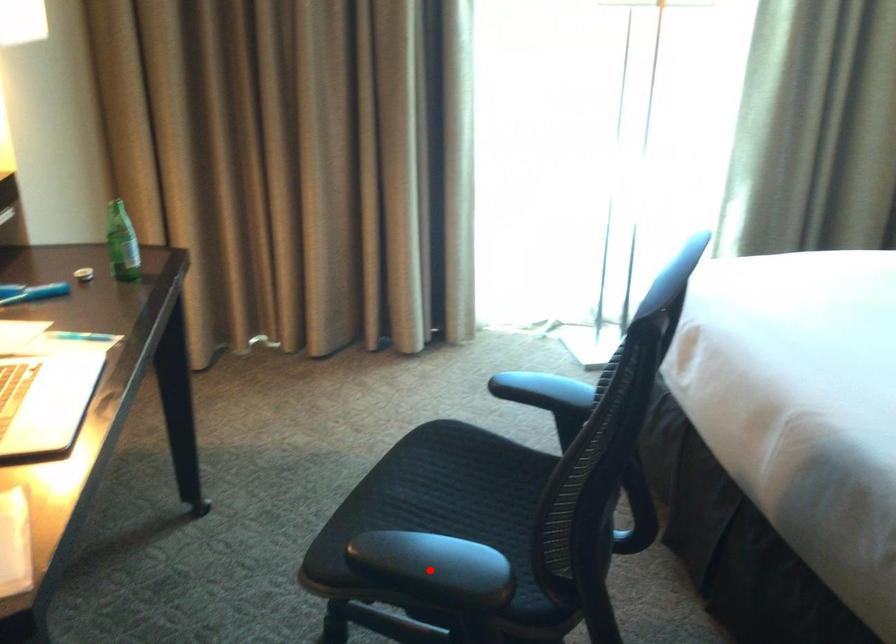
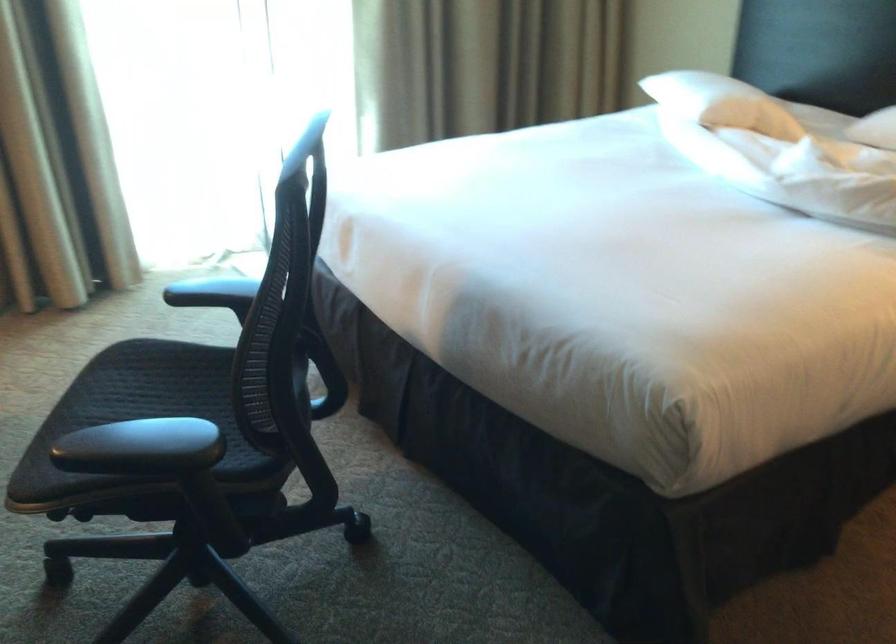
The point at the highlighted location is marked in the first image. Where is the corresponding point in the second image?

(142, 448)